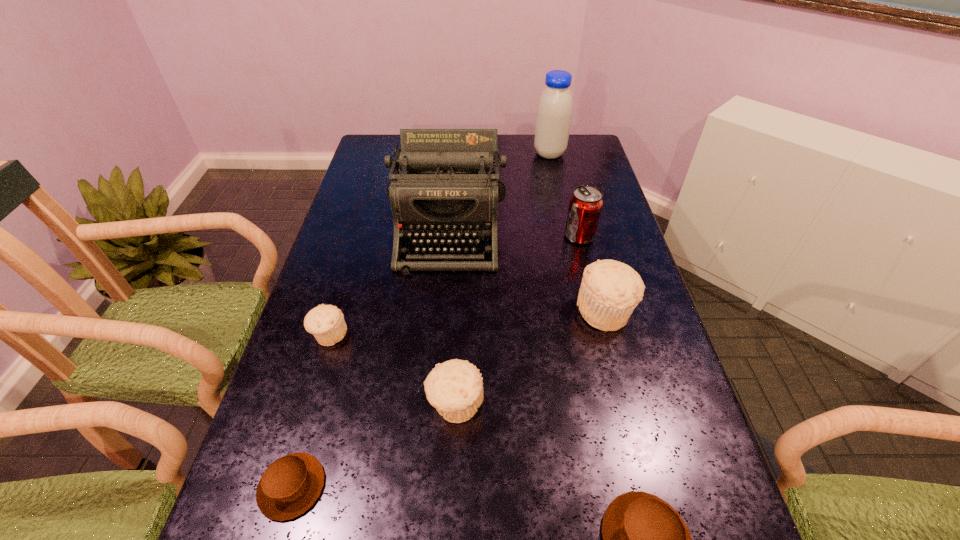
Where is `the smaller brown muffin`? Image resolution: width=960 pixels, height=540 pixels. the smaller brown muffin is located at coordinates (290, 485).

Locate an element on the screen. This screenshot has width=960, height=540. vacant space located 0.380m on the left of the blue soya milk is located at coordinates (432, 154).

This screenshot has height=540, width=960. I want to click on free spot located 0.100m on the keyboard of the typewriter, so click(443, 303).

Locate an element on the screen. free region located 0.100m on the front of the pop soda is located at coordinates (588, 270).

The image size is (960, 540). In order to click on free space located on the left of the rightmost beige muffin in this screenshot , I will do `click(547, 311)`.

At what (x,y) coordinates should I click in order to perform the action: click on vacant space situated 0.270m on the back of the sixth farthest object. Please return your answer as a coordinate pair (x, y). Looking at the image, I should click on (460, 291).

Locate an element on the screen. The width and height of the screenshot is (960, 540). vacant region located on the right of the leftmost beige muffin is located at coordinates pyautogui.click(x=386, y=335).

Locate an element on the screen. This screenshot has width=960, height=540. vacant space situated 0.100m on the back of the shortest muffin is located at coordinates pyautogui.click(x=315, y=407).

Identify the location of object that is at the far edge. (554, 112).

Locate an element on the screen. This screenshot has width=960, height=540. soya milk that is at the right edge is located at coordinates (554, 112).